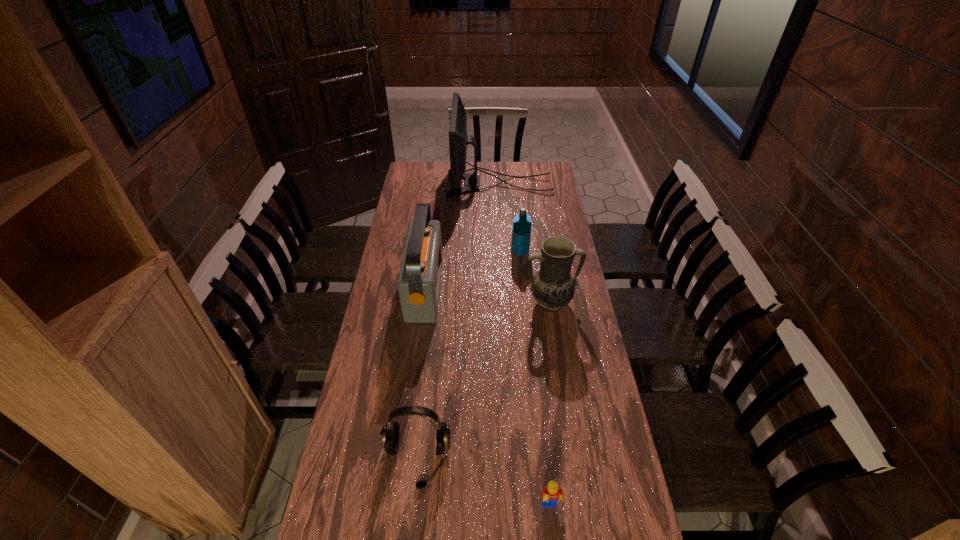
Where is `object at the far right corner`? object at the far right corner is located at coordinates (458, 140).

The image size is (960, 540). Identify the location of vacant area at the far edge. pos(488,178).

Identify the location of free space at the left edge. (379, 301).

Where is `vacant space at the right edge of the desktop`? vacant space at the right edge of the desktop is located at coordinates (541, 228).

You are a GUI agent. You are given a task and a screenshot of the screen. Output one action in this format:
    pyautogui.click(x=<x>, y=<y>)
    Task: Click on the free region at the far left corner of the desktop
    
    Given the screenshot: What is the action you would take?
    pyautogui.click(x=428, y=176)

Where is `vacant area at the far right corner of the desktop`? Image resolution: width=960 pixels, height=540 pixels. vacant area at the far right corner of the desktop is located at coordinates (545, 171).

I want to click on unoccupied position between the radio receiver and the second nearest object, so click(420, 375).

Locate an element on the screen. The height and width of the screenshot is (540, 960). free space between the thermos bottle and the headset is located at coordinates tap(468, 356).

Locate an element on the screen. The height and width of the screenshot is (540, 960). free spot between the pottery and the shortest object is located at coordinates (550, 404).

This screenshot has height=540, width=960. Identify the location of empty space that is in between the thermos bottle and the fifth farthest object. (468, 356).